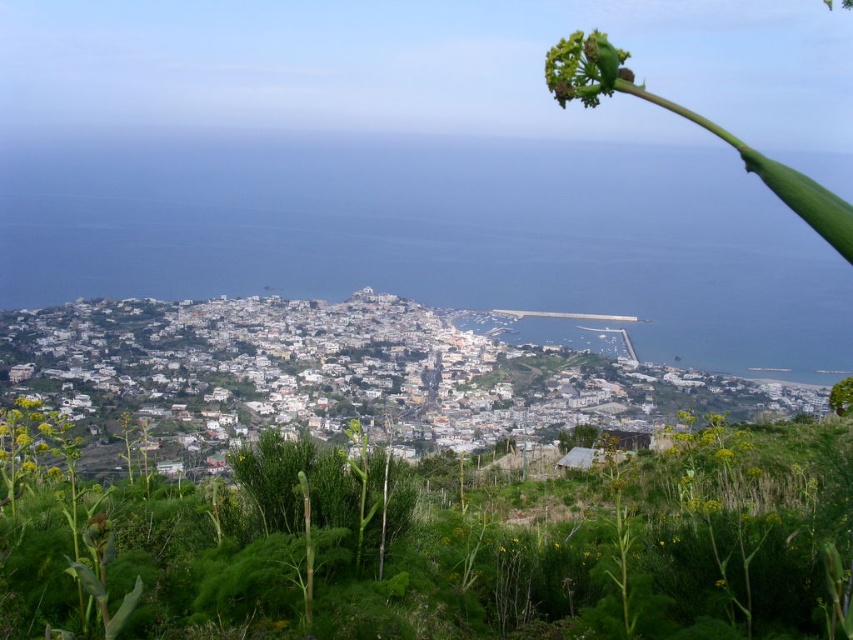
Which is behind, point (426, 520) or point (21, 465)?

Point (21, 465)

Does green leafy plant at center appear on the right side of green leafy plant at lower left?

Yes, green leafy plant at center is to the right of green leafy plant at lower left.

Does point (838, 504) come closer to viewer compared to point (33, 404)?

Yes.

Where is `green leafy plant at center`? The width and height of the screenshot is (853, 640). green leafy plant at center is located at coordinates (445, 547).

Can you confirm if green fuzzy flower at upper center is positioned to the left of green leafy plant at lower left?

Incorrect, green fuzzy flower at upper center is not on the left side of green leafy plant at lower left.

The image size is (853, 640). What do you see at coordinates (584, 68) in the screenshot?
I see `green fuzzy flower at upper center` at bounding box center [584, 68].

Does point (607, 40) come closer to viewer compared to point (10, 460)?

Yes.

The image size is (853, 640). In order to click on green fuzzy flower at upper center in this screenshot , I will do `click(584, 68)`.

Is green leafy plant at center to the right of green fuzzy flower at upper center from the viewer's perspective?

No, green leafy plant at center is not to the right of green fuzzy flower at upper center.

Is green leafy plant at center wider than green fuzzy flower at upper center?

Yes, green leafy plant at center is wider than green fuzzy flower at upper center.

Does point (672, 602) come farther from viewer compared to point (563, 93)?

That is False.

Find the location of a particular element. green leafy plant at center is located at coordinates (445, 547).